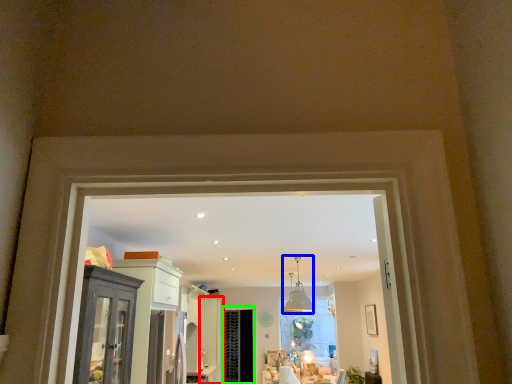
Question: Which object is the farthest from door (highlighted by a red box)? Choose among these: light fixture (highlighted by a blue box) or screen door (highlighted by a green box).

Choices:
 (A) light fixture
 (B) screen door

Answer: (A)